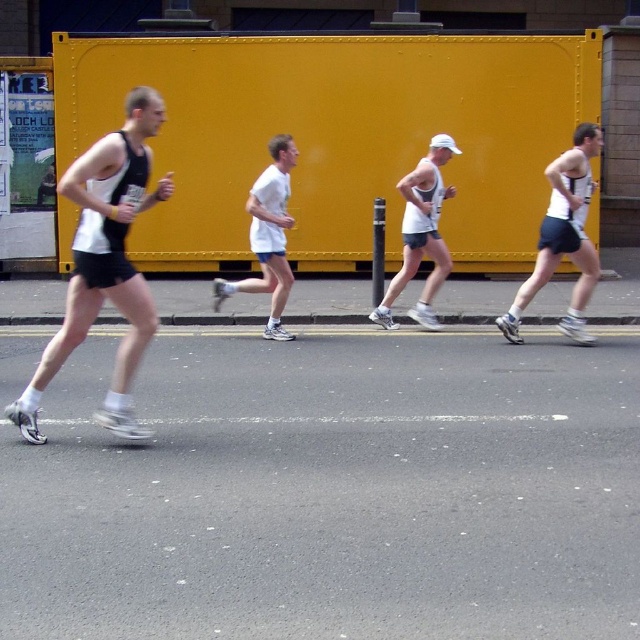
Between white matte shorts at right and white matte shirt at center, which one is positioned higher?

Positioned higher is white matte shirt at center.

Does white matte shorts at right have a greater height compared to white matte shirt at center?

Correct, white matte shorts at right is much taller as white matte shirt at center.

I want to click on white matte shorts at right, so click(x=563, y=236).

The height and width of the screenshot is (640, 640). In order to click on white matte shorts at right in this screenshot , I will do `click(563, 236)`.

Can you confirm if white matte singlet at left is wider than white matte shorts at right?

Yes.

Which is below, white matte singlet at left or white matte shorts at right?

white matte singlet at left is lower down.

I want to click on white matte singlet at left, so click(104, 262).

At what (x,y) coordinates should I click in order to perform the action: click on white matte singlet at left. Please return your answer as a coordinate pair (x, y). Looking at the image, I should click on (104, 262).

Which is more to the right, white matte singlet at left or white matte shirt at center?

Positioned to the right is white matte shirt at center.

Find the location of a particular element. The width and height of the screenshot is (640, 640). white matte singlet at left is located at coordinates (104, 262).

At what (x,y) coordinates should I click in order to perform the action: click on white matte singlet at left. Please return your answer as a coordinate pair (x, y). The height and width of the screenshot is (640, 640). Looking at the image, I should click on (104, 262).